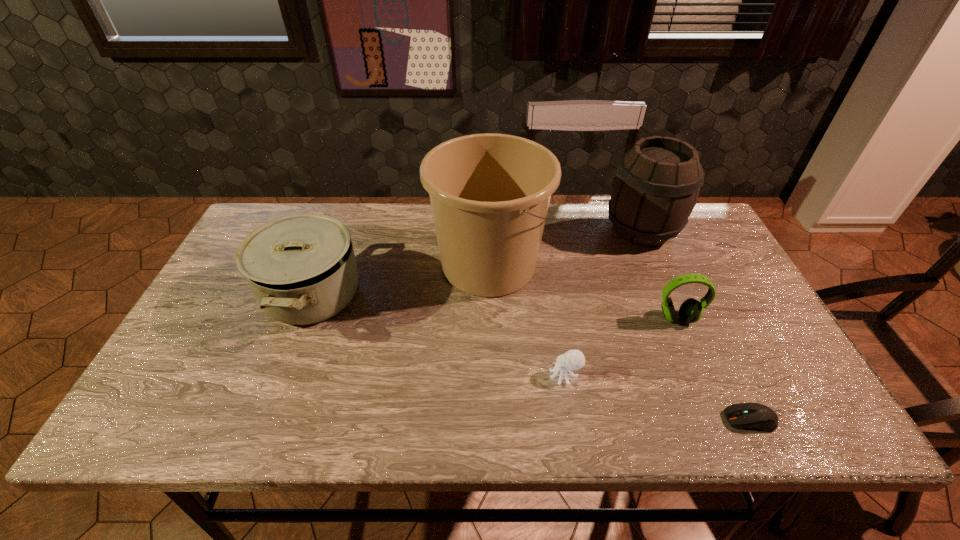
Locate an element on the screen. The height and width of the screenshot is (540, 960). vacant area that lies between the headset and the shortest object is located at coordinates (713, 369).

The image size is (960, 540). I want to click on unoccupied area between the wine bucket and the nearest object, so click(696, 325).

Locate an element on the screen. vacant area between the wine bucket and the nearest object is located at coordinates (696, 325).

Locate an element on the screen. This screenshot has height=540, width=960. the fourth closest object to the wine bucket is located at coordinates (757, 416).

Identify the location of object that is the fourth closest one to the fifth farthest object. Image resolution: width=960 pixels, height=540 pixels. (657, 182).